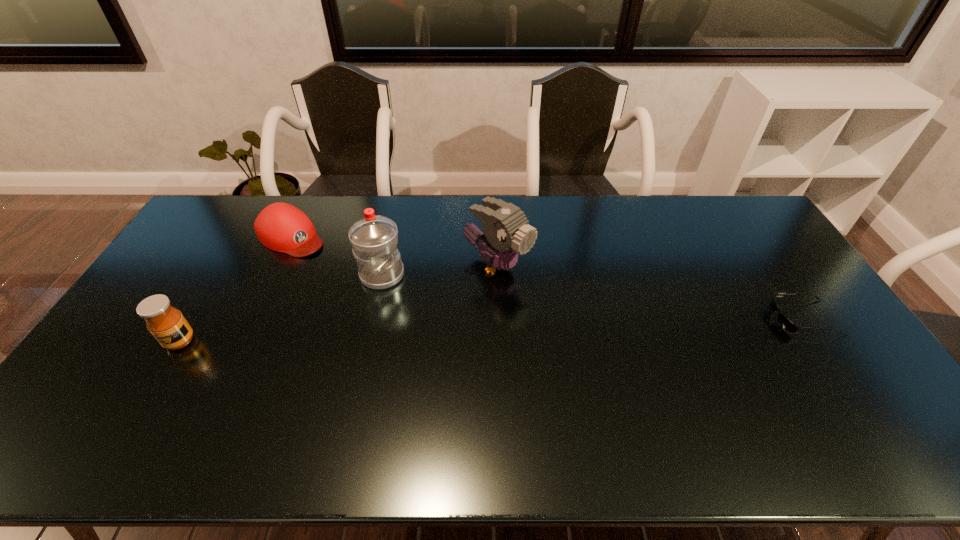
Image resolution: width=960 pixels, height=540 pixels. In order to click on vacant space located 0.070m at the beak of the fourth object from left to right in this screenshot , I will do `click(540, 294)`.

The image size is (960, 540). I want to click on object that is at the far edge, so click(281, 227).

The height and width of the screenshot is (540, 960). Find the location of `object situated at the left edge`. object situated at the left edge is located at coordinates (166, 323).

Locate an element on the screen. This screenshot has height=540, width=960. object that is at the right edge is located at coordinates (784, 322).

The height and width of the screenshot is (540, 960). I want to click on free space at the far edge of the desktop, so click(585, 210).

The height and width of the screenshot is (540, 960). In the image, there is a desktop. Identify the location of vacant space at the near edge. (771, 408).

This screenshot has height=540, width=960. Identify the location of vacant space at the left edge of the desktop. (156, 281).

In the image, there is a desktop. Identify the location of free region at the far right corner. Image resolution: width=960 pixels, height=540 pixels. (754, 225).

This screenshot has height=540, width=960. Identify the location of free space between the shortest object and the fourth object from right to left. (547, 277).

You are a GUI agent. You are given a task and a screenshot of the screen. Output one action in this format:
    pyautogui.click(x=<x>, y=<y>)
    Task: Click on the empty space between the leftmost object and the rightmost object
    This screenshot has width=960, height=540.
    Given the screenshot: What is the action you would take?
    pyautogui.click(x=492, y=329)